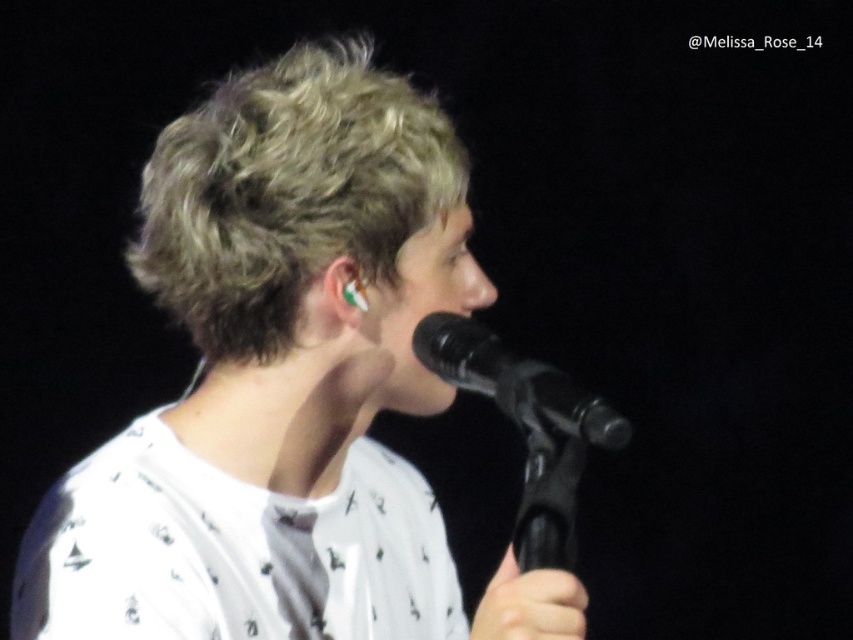
You are a sound technician adjusting the microphone stand for a performer. The performer has blonde curly hair at center and is holding a black matte microphone at center. To ensure the microphone doesn not obstruct the performer s hair in the camera shot, should you raise or lower the microphone stand?

The blonde curly hair at center is positioned over the black matte microphone at center. To prevent the microphone from obstructing the hair in the camera shot, you should lower the microphone stand so that the black matte microphone at center is moved downward, placing it below the blonde curly hair at center.

You are a photographer adjusting your camera settings to capture the performer. Since you want to focus on the face, which object should you prioritize positioning closer to the camera lens between the blonde curly hair at center and the black matte microphone at center?

The blonde curly hair at center is closer to the viewer than the black matte microphone at center, so to focus on the face, prioritize positioning the blonde curly hair at center closer to the camera lens.

You are a photographer at a concert. You need to adjust your camera to focus on the white printed shirt at center and the blonde curly hair at center. Which object should you focus on first if you want to capture both in the same frame without changing the camera settings?

The white printed shirt at center has a larger size compared to blonde curly hair at center, so you should focus on the white printed shirt at center first to ensure it is in sharp focus, and the blonde curly hair at center will also be in focus due to its smaller size and proximity in the same plane.